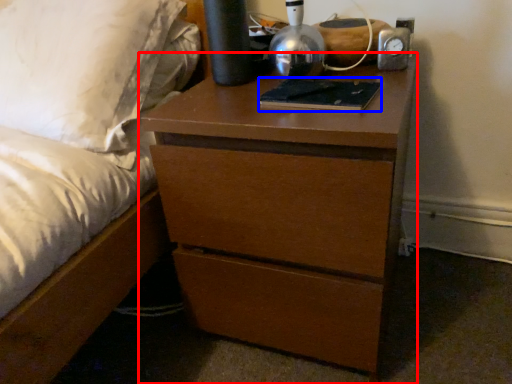
Question: Which object is closer to the camera taking this photo, chest of drawers (highlighted by a red box) or book (highlighted by a blue box)?

Choices:
 (A) chest of drawers
 (B) book

Answer: (A)